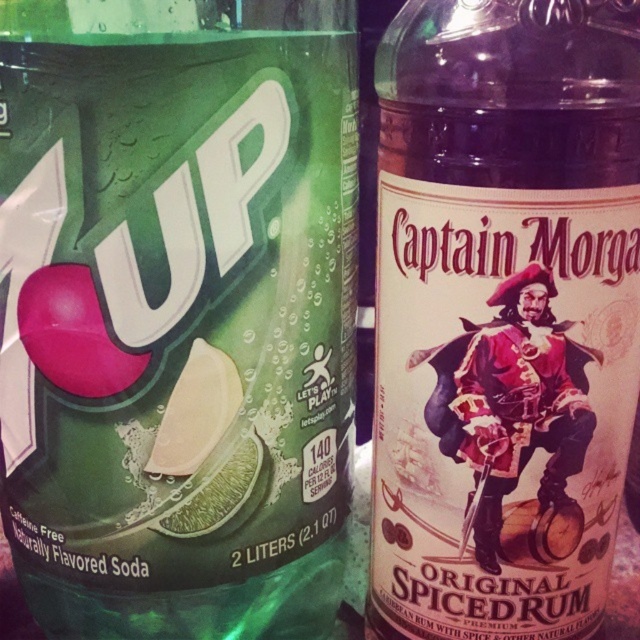
You are holding a measuring tool that can only measure distances up to 20 inches. You want to measure the distance of the point labeled as point (524, 45) from the camera. Can your tool measure it?

The point labeled as point (524, 45) is 21.30 inches from the camera, which is beyond the 20 inches limit of the measuring tool. Therefore, the tool cannot measure it.

You are a bartender setting up a display. You have a green matte soda bottle at center and a translucent glass bottle at right. Which bottle is taller?

The green matte soda bottle at center is taller than the translucent glass bottle at right.

You are a bartender preparing a drink and need to place the green matte soda bottle at center and the green matte lime at center on a shelf. The shelf has limited vertical space. Which object should you place first to ensure both fit vertically?

The green matte soda bottle at center is above the green matte lime at center, so you should place the green matte lime at center first to make vertical space for the soda bottle above it.